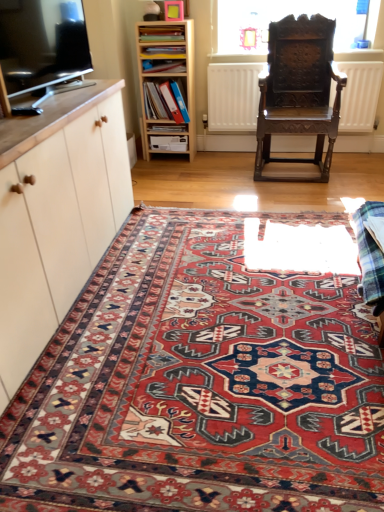
I want to click on free point to the left of white matte radiator at center, so click(193, 173).